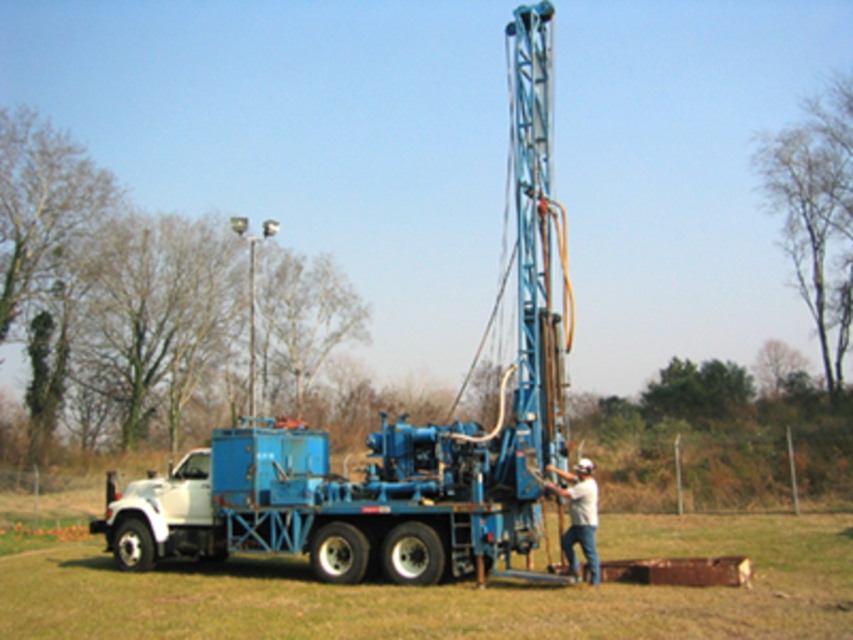
You are a safety inspector standing at the edge of the grassy area. You need to walk towards the blue metallic truck at center and the light beige fabric shirt at center. Which object should you approach first to reach the shirt without passing by the truck?

You should approach the light beige fabric shirt at center first because the blue metallic truck at center is to the left of it, so the shirt is to the right of the truck. By moving towards the shirt directly, you can reach it without passing by the truck.

You are a delivery driver who needs to park your truck next to the matte blue truck at center and the light beige fabric shirt at center. Since you need to ensure there is enough space between your truck and the existing vehicles, can you determine which object you should park closer to based on their sizes?

The matte blue truck at center is wider than the light beige fabric shirt at center, so you should park closer to the light beige fabric shirt at center to ensure sufficient space between your truck and the larger matte blue truck at center.